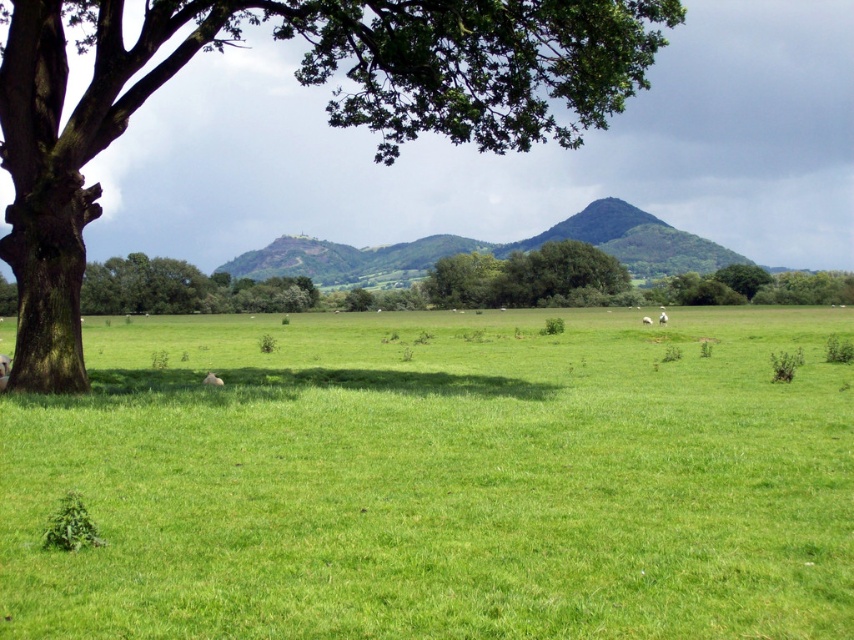
Is white fluffy sheep at center taller than white woolly sheep at center?

Yes, white fluffy sheep at center is taller than white woolly sheep at center.

Is white fluffy sheep at center wider than white woolly sheep at center?

Yes.

Is point (661, 314) closer to camera compared to point (646, 323)?

No, it is not.

Find the location of `white fluffy sheep at center`. white fluffy sheep at center is located at coordinates (662, 317).

Does green grass pasture at center lie behind white woolly sheep at center?

That is False.

Who is positioned more to the right, green grass pasture at center or white woolly sheep at center?

Positioned to the right is white woolly sheep at center.

Describe the element at coordinates (439, 480) in the screenshot. I see `green grass pasture at center` at that location.

In order to click on green grass pasture at center in this screenshot , I will do (x=439, y=480).

Which is below, green textured hill at center or white fluffy sheep at center?

white fluffy sheep at center

Is the position of green textured hill at center less distant than that of white fluffy sheep at center?

That is False.

Where is `green textured hill at center`? The height and width of the screenshot is (640, 854). green textured hill at center is located at coordinates (493, 250).